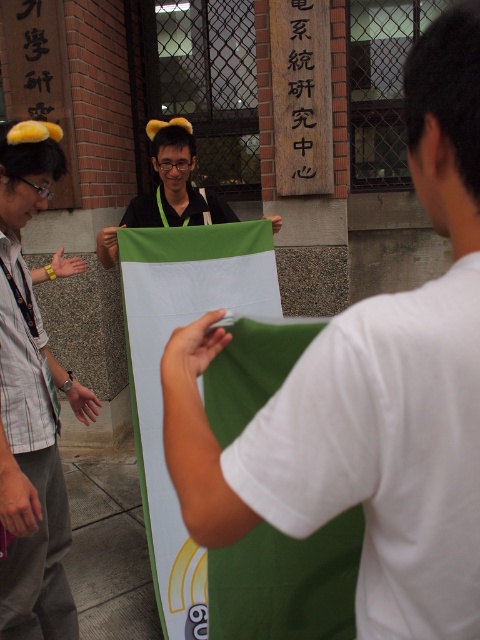
Does matte green fabric at center have a lesser height compared to green matte flag at center?

No.

Can you confirm if matte green fabric at center is thinner than green matte flag at center?

Indeed, matte green fabric at center has a lesser width compared to green matte flag at center.

The image size is (480, 640). What do you see at coordinates (32, 401) in the screenshot?
I see `matte green fabric at center` at bounding box center [32, 401].

Identify the location of matte green fabric at center. Image resolution: width=480 pixels, height=640 pixels. (32, 401).

Is green fabric at center to the right of green matte flag at center from the viewer's perspective?

Indeed, green fabric at center is positioned on the right side of green matte flag at center.

The width and height of the screenshot is (480, 640). Find the location of `green fabric at center`. green fabric at center is located at coordinates (371, 394).

Where is `green fabric at center`? The height and width of the screenshot is (640, 480). green fabric at center is located at coordinates (371, 394).

Is point (188, 422) positioned behind point (22, 173)?

No, it is in front of (22, 173).

Based on the photo, between green fabric at center and matte green fabric at center, which one is positioned lower?

Positioned lower is matte green fabric at center.

Locate an element on the screen. green fabric at center is located at coordinates (371, 394).